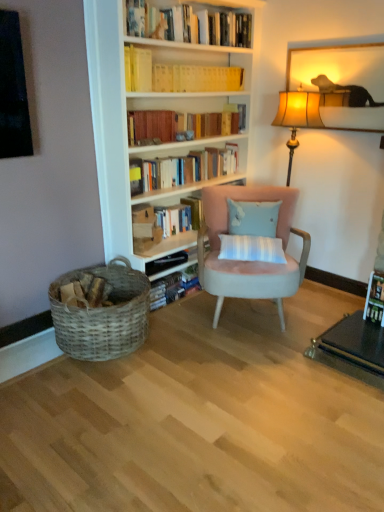
The image size is (384, 512). In order to click on free space in front of woven wood basket at lower left in this screenshot , I will do `click(89, 394)`.